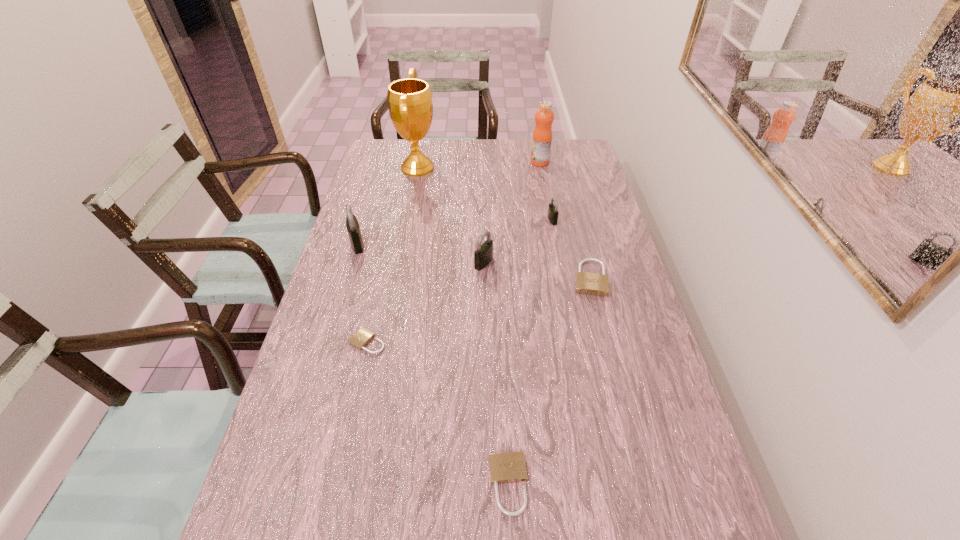
In order to click on vacant position at the far left corner of the desktop in this screenshot , I will do click(380, 152).

This screenshot has height=540, width=960. Identify the location of vacant space at the far right corner. (589, 156).

Where is `unoccupied position between the leftmost beige padlock and the third tallest padlock`? unoccupied position between the leftmost beige padlock and the third tallest padlock is located at coordinates [x=460, y=281].

Identify the location of unoccupied area between the fifth padlock from right to left and the seventh shortest object. Image resolution: width=960 pixels, height=540 pixels. (453, 252).

This screenshot has height=540, width=960. What are the coordinates of `empty space between the seventh shortest object and the second farthest padlock` in the screenshot? It's located at pyautogui.click(x=448, y=203).

Find the location of a particular element. The image size is (960, 540). empty location between the award and the second black padlock from left to right is located at coordinates (450, 215).

At what (x,y) coordinates should I click in order to perform the action: click on free space between the rightmost beige padlock and the second farthest beige padlock. Please return your answer as a coordinate pair (x, y). This screenshot has width=960, height=540. Looking at the image, I should click on (478, 310).

Where is `free space between the fruit juice and the rightmost padlock`? free space between the fruit juice and the rightmost padlock is located at coordinates (564, 220).

Find the location of a particular element. The image size is (960, 540). vacant space in between the nearest black padlock and the seventh shortest object is located at coordinates (512, 212).

Identify the location of free area in between the second tallest object and the second nearest padlock. (453, 252).